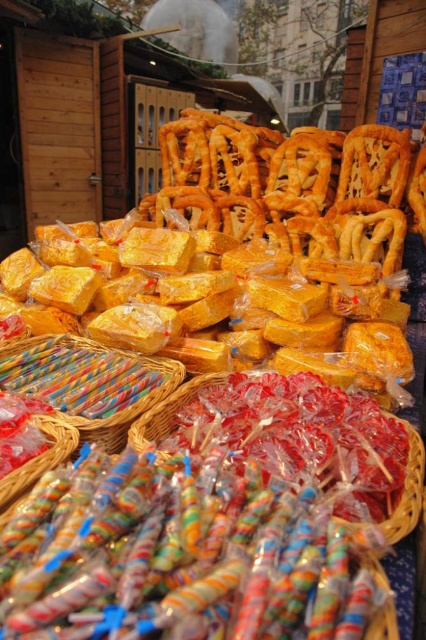
Who is more forward, (270, 513) or (405, 488)?

Point (270, 513)

Can you confirm if multicolored wrapped lollipops at lower center is taller than translucent plastic candy at lower center?

Correct, multicolored wrapped lollipops at lower center is much taller as translucent plastic candy at lower center.

The height and width of the screenshot is (640, 426). Find the location of `multicolored wrapped lollipops at lower center`. multicolored wrapped lollipops at lower center is located at coordinates (176, 557).

This screenshot has width=426, height=640. Identify the location of multicolored wrapped lollipops at lower center. (176, 557).

Can you confirm if translucent plastic candy at lower center is positioned below multicolored plastic candy at lower center?

No.

Between translucent plastic candy at lower center and multicolored plastic candy at lower center, which one appears on the right side from the viewer's perspective?

From the viewer's perspective, translucent plastic candy at lower center appears more on the right side.

Does point (388, 525) come behind point (78, 433)?

No, (388, 525) is in front of (78, 433).

Locate an element on the screen. translucent plastic candy at lower center is located at coordinates (166, 412).

Is multicolored wrapped lollipops at lower center above multicolored plastic candy at lower center?

No.

Who is lower down, multicolored wrapped lollipops at lower center or multicolored plastic candy at lower center?

multicolored wrapped lollipops at lower center is below.

Is point (238, 564) closer to camera compared to point (34, 460)?

Yes.

The width and height of the screenshot is (426, 640). What are the coordinates of `multicolored wrapped lollipops at lower center` in the screenshot? It's located at (176, 557).